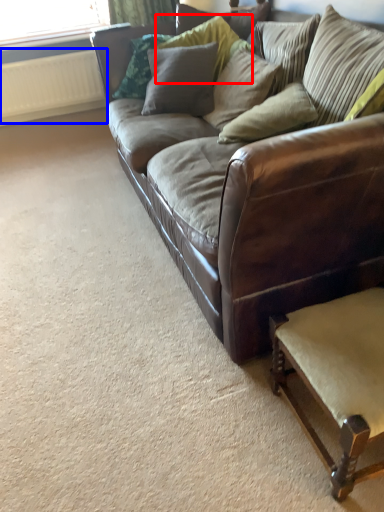
Question: Which object appears closest to the camera in this image, pillow (highlighted by a red box) or radiator (highlighted by a blue box)?

Choices:
 (A) pillow
 (B) radiator

Answer: (A)